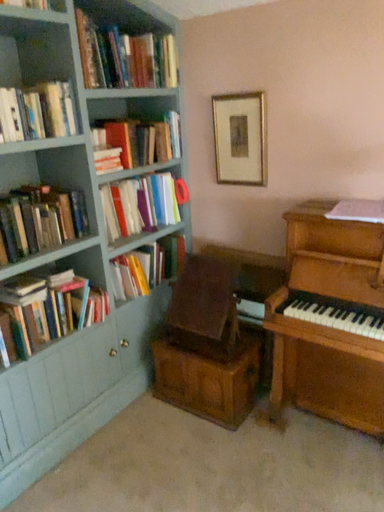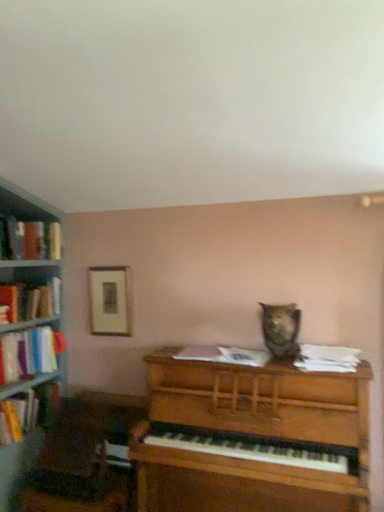
Question: Which way did the camera rotate in the video?

Choices:
 (A) rotated left
 (B) rotated right

Answer: (B)